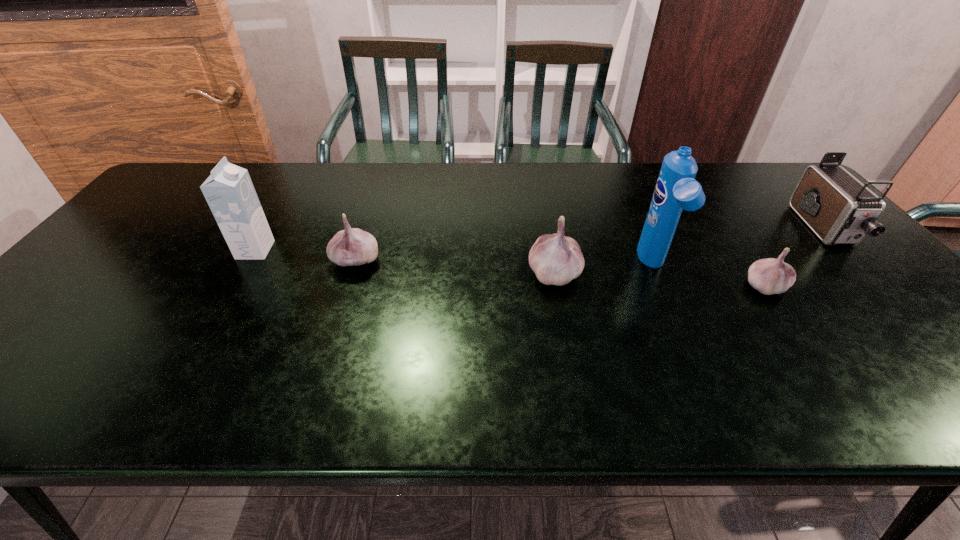
This screenshot has width=960, height=540. Find the location of `the second object from left to right`. the second object from left to right is located at coordinates (352, 246).

Locate an element on the screen. This screenshot has height=540, width=960. the second tallest garlic is located at coordinates (352, 246).

Find the location of a particular element. Image resolution: width=960 pixels, height=540 pixels. the second garlic from right to left is located at coordinates (556, 259).

Where is `the fifth object from left to right`? Image resolution: width=960 pixels, height=540 pixels. the fifth object from left to right is located at coordinates (769, 276).

You are a GUI agent. You are given a task and a screenshot of the screen. Output one action in this format:
    pyautogui.click(x=<x>, y=<y>)
    Task: Click on the shortest garlic
    The width and height of the screenshot is (960, 540).
    Given the screenshot: What is the action you would take?
    pyautogui.click(x=769, y=276)

The height and width of the screenshot is (540, 960). Identify the location of camcorder. (837, 207).

Locate an element on the screen. The height and width of the screenshot is (540, 960). the leftmost object is located at coordinates (229, 191).

Where is `carton`? carton is located at coordinates (229, 191).

This screenshot has height=540, width=960. I want to click on shampoo, so click(676, 189).

You are a GUI agent. You are given a task and a screenshot of the screen. Output one action in this format:
    pyautogui.click(x=<x>, y=<y>)
    Task: Click on the third object from right to left
    This screenshot has width=960, height=540.
    Given the screenshot: What is the action you would take?
    pyautogui.click(x=676, y=189)